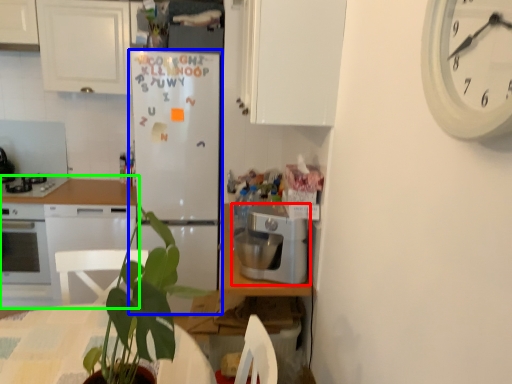
Question: Which is nearer to the kitchen appliance (highlighted by a red box)? refrigerator (highlighted by a blue box) or countertop (highlighted by a green box).

Choices:
 (A) refrigerator
 (B) countertop

Answer: (A)